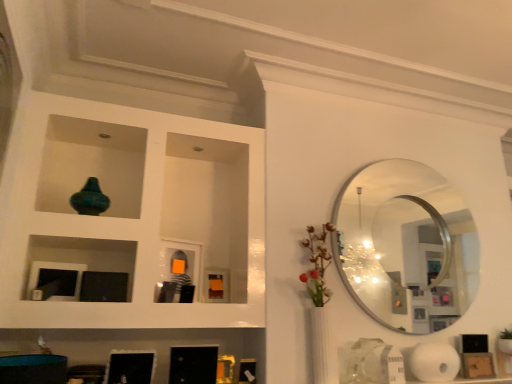
Question: Is white matte paper towel at lower right taller than teal glass vase at upper left?

Choices:
 (A) no
 (B) yes

Answer: (A)

Question: Is the depth of white matte paper towel at lower right greater than that of teal glass vase at upper left?

Choices:
 (A) no
 (B) yes

Answer: (B)

Question: Considering the relative positions of white matte paper towel at lower right and teal glass vase at upper left in the image provided, is white matte paper towel at lower right to the right of teal glass vase at upper left from the viewer's perspective?

Choices:
 (A) yes
 (B) no

Answer: (A)

Question: From the image's perspective, is white matte paper towel at lower right on top of teal glass vase at upper left?

Choices:
 (A) no
 (B) yes

Answer: (A)

Question: Is white matte paper towel at lower right positioned with its back to teal glass vase at upper left?

Choices:
 (A) no
 (B) yes

Answer: (A)

Question: Do you think silver metallic mirror at upper right is within teal glass vase at upper left, or outside of it?

Choices:
 (A) inside
 (B) outside

Answer: (B)

Question: Would you say silver metallic mirror at upper right is to the left or to the right of teal glass vase at upper left in the picture?

Choices:
 (A) left
 (B) right

Answer: (B)

Question: In terms of height, does silver metallic mirror at upper right look taller or shorter compared to teal glass vase at upper left?

Choices:
 (A) short
 (B) tall

Answer: (B)

Question: Considering the positions of silver metallic mirror at upper right and teal glass vase at upper left in the image, is silver metallic mirror at upper right bigger or smaller than teal glass vase at upper left?

Choices:
 (A) big
 (B) small

Answer: (A)

Question: Based on their sizes in the image, would you say white matte paper towel at lower right is bigger or smaller than teal glass vase at upper left?

Choices:
 (A) big
 (B) small

Answer: (A)

Question: Which is correct: white matte paper towel at lower right is inside teal glass vase at upper left, or outside of it?

Choices:
 (A) outside
 (B) inside

Answer: (A)

Question: In terms of width, does white matte paper towel at lower right look wider or thinner when compared to teal glass vase at upper left?

Choices:
 (A) thin
 (B) wide

Answer: (A)

Question: Is white matte paper towel at lower right in front of or behind teal glass vase at upper left in the image?

Choices:
 (A) front
 (B) behind

Answer: (B)

Question: From a real-world perspective, relative to silver metallic mirror at upper right, is white matte paper towel at lower right vertically above or below?

Choices:
 (A) above
 (B) below

Answer: (B)

Question: In the image, is white matte paper towel at lower right positioned in front of or behind silver metallic mirror at upper right?

Choices:
 (A) front
 (B) behind

Answer: (A)